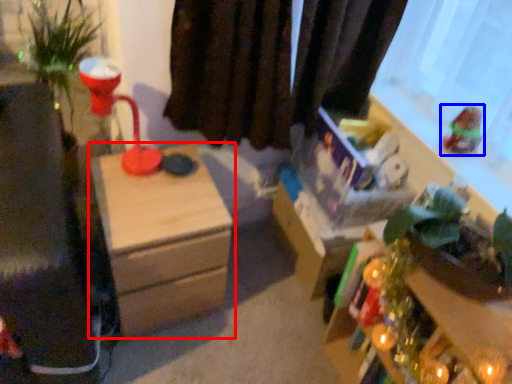
Question: Which object appears closest to the camera in this image, nightstand (highlighted by a red box) or toy (highlighted by a blue box)?

Choices:
 (A) nightstand
 (B) toy

Answer: (A)